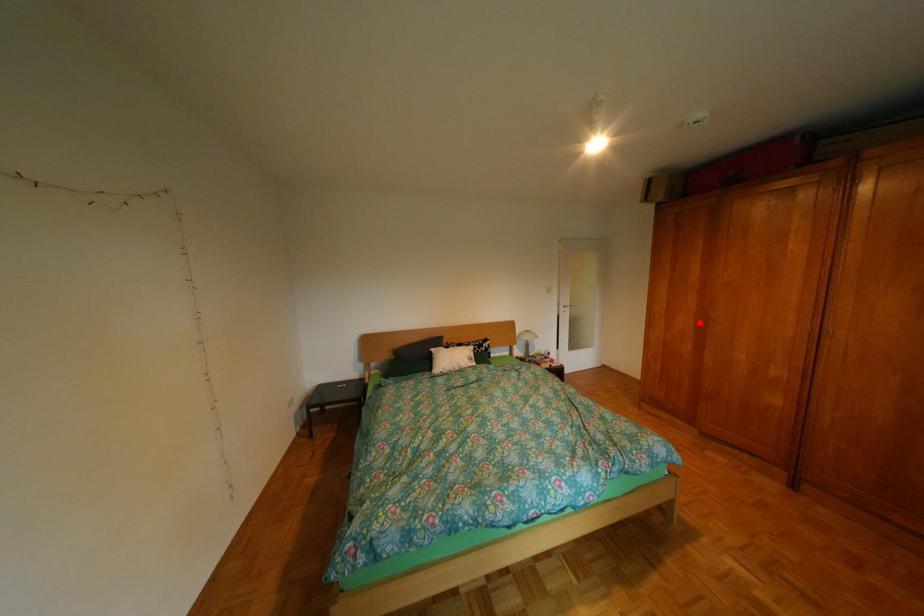
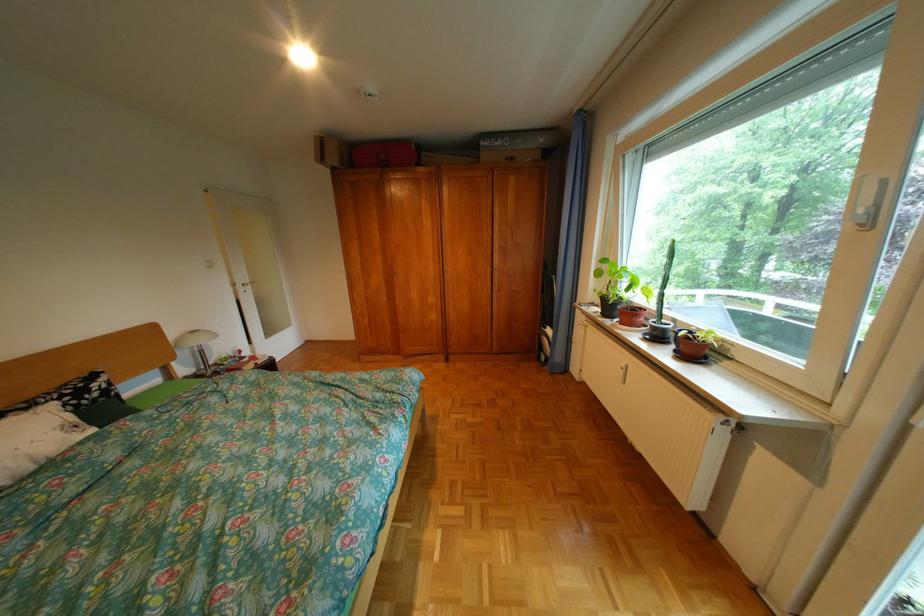
Question: I am providing you with two images of the same scene from different viewpoints. In image1, a red point is highlighted. Considering the same 3D point in image2, which of the following is correct?

Choices:
 (A) It is closer
 (B) It is farther

Answer: (A)